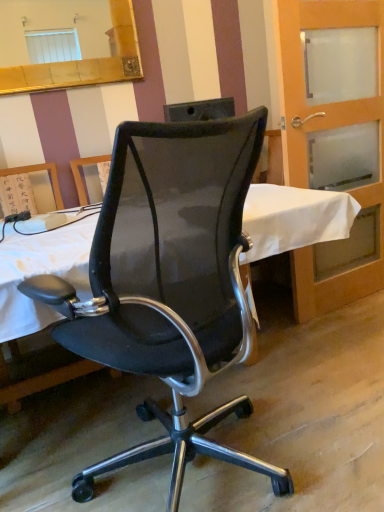
Question: From the image's perspective, is translucent glass door at right located above gold-framed mirror at upper left?

Choices:
 (A) yes
 (B) no

Answer: (B)

Question: From the image's perspective, is translucent glass door at right beneath gold-framed mirror at upper left?

Choices:
 (A) no
 (B) yes

Answer: (B)

Question: Does translucent glass door at right have a greater width compared to gold-framed mirror at upper left?

Choices:
 (A) yes
 (B) no

Answer: (A)

Question: Is translucent glass door at right in front of gold-framed mirror at upper left?

Choices:
 (A) yes
 (B) no

Answer: (A)

Question: Is translucent glass door at right turned away from gold-framed mirror at upper left?

Choices:
 (A) no
 (B) yes

Answer: (A)

Question: Is translucent glass door at right facing towards gold-framed mirror at upper left?

Choices:
 (A) no
 (B) yes

Answer: (A)

Question: Is black mesh office chair at center thinner than translucent glass door at right?

Choices:
 (A) no
 (B) yes

Answer: (A)

Question: Considering the relative positions of black mesh office chair at center and translucent glass door at right in the image provided, is black mesh office chair at center behind translucent glass door at right?

Choices:
 (A) no
 (B) yes

Answer: (A)

Question: Is black mesh office chair at center far away from translucent glass door at right?

Choices:
 (A) no
 (B) yes

Answer: (B)

Question: Considering the relative sizes of black mesh office chair at center and translucent glass door at right in the image provided, is black mesh office chair at center wider than translucent glass door at right?

Choices:
 (A) no
 (B) yes

Answer: (B)

Question: Does black mesh office chair at center turn towards translucent glass door at right?

Choices:
 (A) yes
 (B) no

Answer: (B)

Question: From a real-world perspective, is black mesh office chair at center beneath translucent glass door at right?

Choices:
 (A) no
 (B) yes

Answer: (B)

Question: From a real-world perspective, is translucent glass door at right positioned under black mesh office chair at center based on gravity?

Choices:
 (A) no
 (B) yes

Answer: (A)